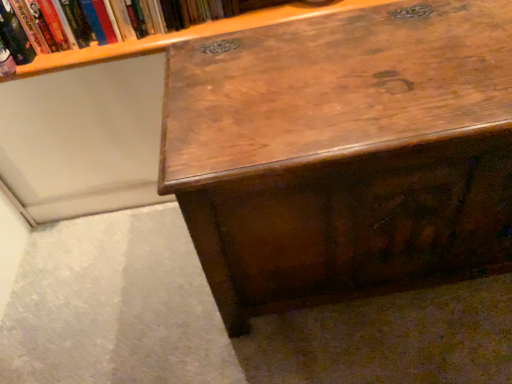
Question: Based on their sizes in the image, would you say hardcover book at upper left is bigger or smaller than shiny brown wood desk at center?

Choices:
 (A) small
 (B) big

Answer: (A)

Question: Visually, is hardcover book at upper left positioned to the left or to the right of shiny brown wood desk at center?

Choices:
 (A) right
 (B) left

Answer: (B)

Question: Is hardcover book at upper left in front of or behind shiny brown wood desk at center in the image?

Choices:
 (A) front
 (B) behind

Answer: (B)

Question: In the image, is shiny brown wood desk at center on the left side or the right side of hardcover book at upper left?

Choices:
 (A) right
 (B) left

Answer: (A)

Question: Looking at the image, does shiny brown wood desk at center seem bigger or smaller compared to hardcover book at upper left?

Choices:
 (A) small
 (B) big

Answer: (B)

Question: Looking at their shapes, would you say shiny brown wood desk at center is wider or thinner than hardcover book at upper left?

Choices:
 (A) wide
 (B) thin

Answer: (A)

Question: In the image, is shiny brown wood desk at center positioned in front of or behind hardcover book at upper left?

Choices:
 (A) behind
 (B) front

Answer: (B)